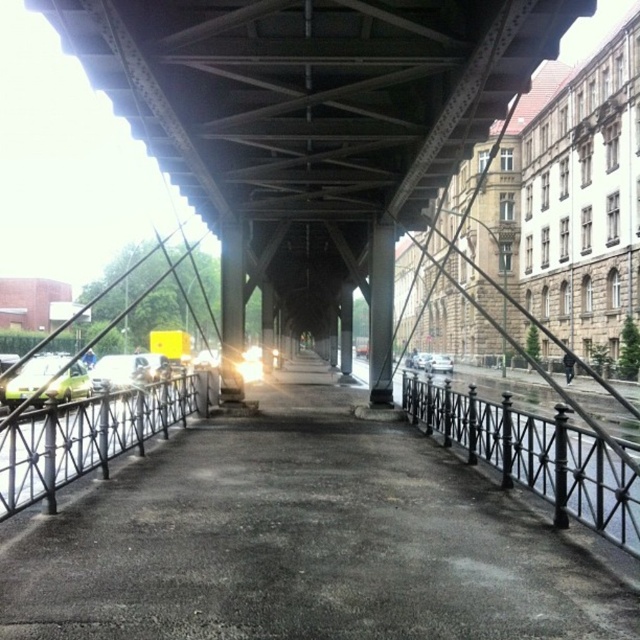
You are a pedestrian standing on the walkway under the bridge. You see a green matte car at left and a silver metallic car at center. Which car is positioned more to the left side of the walkway?

The green matte car at left is positioned more to the left side of the walkway as it is to the left of the silver metallic car at center.

In the scene shown: You are standing on the concrete walkway under the industrial bridge and see the point marked at coordinates (90, 435). What object is located at that point?

The point at coordinates (90, 435) indicates the location of the black metal rail at left.